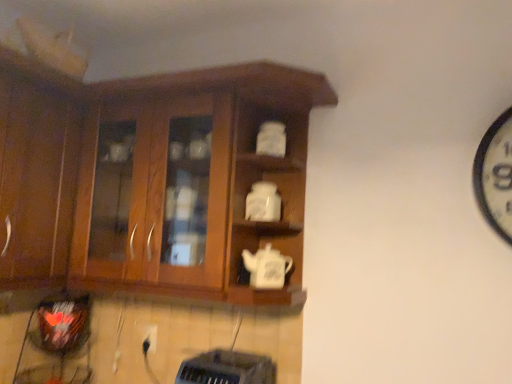
Question: Is white matte teapot at center, the 2th teapot ordered from the bottom, bigger or smaller than white matte teapot at center, the 2th teapot when ordered from top to bottom?

Choices:
 (A) big
 (B) small

Answer: (B)

Question: Considering their positions, is white matte teapot at center, the 2th teapot ordered from the bottom, located in front of or behind white matte teapot at center, the 1th teapot from the bottom?

Choices:
 (A) behind
 (B) front

Answer: (A)

Question: Based on their relative distances, which object is nearer to the wooden cabinet at left, arranged as the second cabinetry when viewed from the right?

Choices:
 (A) black plastic toaster at lower center
 (B) white plastic electric outlet at lower center
 (C) white matte teapot at center, placed as the 1th teapot when sorted from top to bottom
 (D) wooden cabinet at center, the second cabinetry in the left-to-right sequence
 (E) white matte teapot at center, the 2th teapot when ordered from top to bottom

Answer: (D)

Question: Estimate the real-world distances between objects in this image. Which object is closer to the wooden cabinet at center, the second cabinetry in the left-to-right sequence?

Choices:
 (A) white plastic electric outlet at lower center
 (B) white matte teapot at center, placed as the 1th teapot when sorted from top to bottom
 (C) white matte teapot at center, the 1th teapot from the bottom
 (D) black plastic toaster at lower center
 (E) wooden cabinet at left, arranged as the second cabinetry when viewed from the right

Answer: (E)